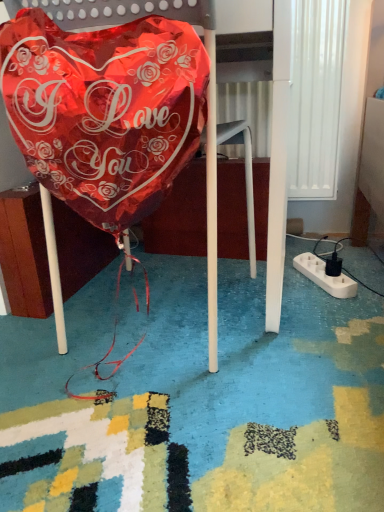
What are the coordinates of `vacant area that lies between shiny metallic balloon at center and white plastic extension cord at lower right` in the screenshot? It's located at (304, 294).